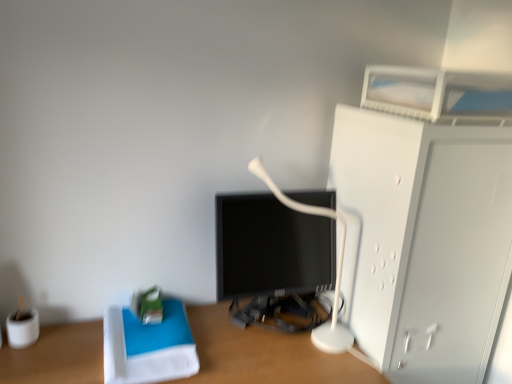
The width and height of the screenshot is (512, 384). What are the coordinates of `free location above wooden desk at center (from a real-world perspective)` in the screenshot? It's located at (203, 353).